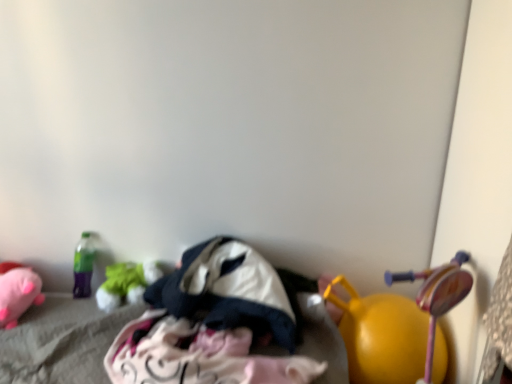
Question: Is green fabric toy at left, the second toy in the right-to-left sequence, further to camera compared to soft pink plush at lower left, placed as the third toy when sorted from right to left?

Choices:
 (A) no
 (B) yes

Answer: (B)

Question: Is soft pink plush at lower left, the first toy from the left, inside green fabric toy at left, which is the 2th toy from left to right?

Choices:
 (A) yes
 (B) no

Answer: (B)

Question: Is green fabric toy at left, which is the 2th toy from left to right, bigger than soft pink plush at lower left, the first toy from the left?

Choices:
 (A) yes
 (B) no

Answer: (B)

Question: Is green fabric toy at left, which is the 2th toy from left to right, not close to soft pink plush at lower left, the first toy from the left?

Choices:
 (A) no
 (B) yes

Answer: (A)

Question: From the image's perspective, is green fabric toy at left, the second toy in the right-to-left sequence, on top of soft pink plush at lower left, placed as the third toy when sorted from right to left?

Choices:
 (A) no
 (B) yes

Answer: (B)

Question: Is green fabric toy at left, the second toy in the right-to-left sequence, with soft pink plush at lower left, placed as the third toy when sorted from right to left?

Choices:
 (A) yes
 (B) no

Answer: (B)

Question: Could you tell me if yellow rubber ball at lower right, placed as the first toy when sorted from right to left, is turned towards soft pink plush at lower left, the first toy from the left?

Choices:
 (A) yes
 (B) no

Answer: (B)

Question: Is yellow rubber ball at lower right, arranged as the 3th toy when viewed from the left, thinner than soft pink plush at lower left, the first toy from the left?

Choices:
 (A) no
 (B) yes

Answer: (A)

Question: Considering the relative sizes of yellow rubber ball at lower right, arranged as the 3th toy when viewed from the left, and soft pink plush at lower left, placed as the third toy when sorted from right to left, in the image provided, is yellow rubber ball at lower right, arranged as the 3th toy when viewed from the left, shorter than soft pink plush at lower left, placed as the third toy when sorted from right to left,?

Choices:
 (A) yes
 (B) no

Answer: (B)

Question: Is there a large distance between yellow rubber ball at lower right, placed as the first toy when sorted from right to left, and soft pink plush at lower left, placed as the third toy when sorted from right to left?

Choices:
 (A) no
 (B) yes

Answer: (B)

Question: Is yellow rubber ball at lower right, placed as the first toy when sorted from right to left, further to camera compared to soft pink plush at lower left, the first toy from the left?

Choices:
 (A) no
 (B) yes

Answer: (A)

Question: From the image's perspective, is yellow rubber ball at lower right, arranged as the 3th toy when viewed from the left, beneath soft pink plush at lower left, placed as the third toy when sorted from right to left?

Choices:
 (A) no
 (B) yes

Answer: (B)

Question: Considering the relative sizes of dark blue fabric at center, the first clothing when ordered from top to bottom, and green fabric toy at left, the second toy in the right-to-left sequence, in the image provided, is dark blue fabric at center, the first clothing when ordered from top to bottom, wider than green fabric toy at left, the second toy in the right-to-left sequence,?

Choices:
 (A) yes
 (B) no

Answer: (A)